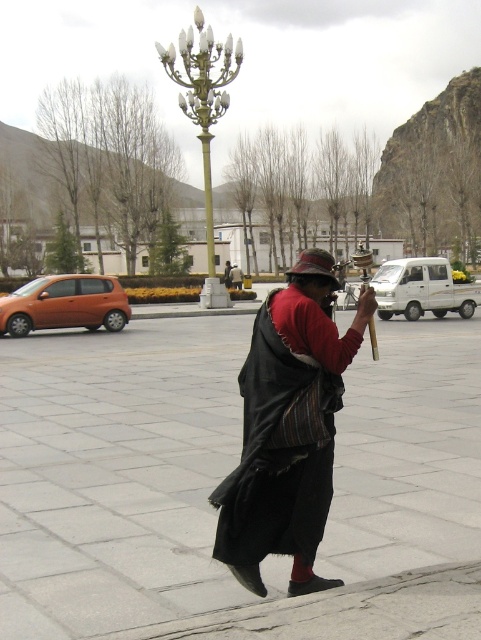
Question: Can you confirm if black woolen robe at center is positioned to the right of gold polished metal lamp post at upper center?

Choices:
 (A) no
 (B) yes

Answer: (B)

Question: Among these points, which one is farthest from the camera?

Choices:
 (A) (212, 257)
 (B) (303, 497)

Answer: (A)

Question: Does black woolen robe at center have a greater width compared to gold polished metal lamp post at upper center?

Choices:
 (A) yes
 (B) no

Answer: (B)

Question: Which object appears farthest from the camera in this image?

Choices:
 (A) gold polished metal lamp post at upper center
 (B) black woolen robe at center

Answer: (A)

Question: Can you confirm if black woolen robe at center is smaller than gold polished metal lamp post at upper center?

Choices:
 (A) no
 (B) yes

Answer: (B)